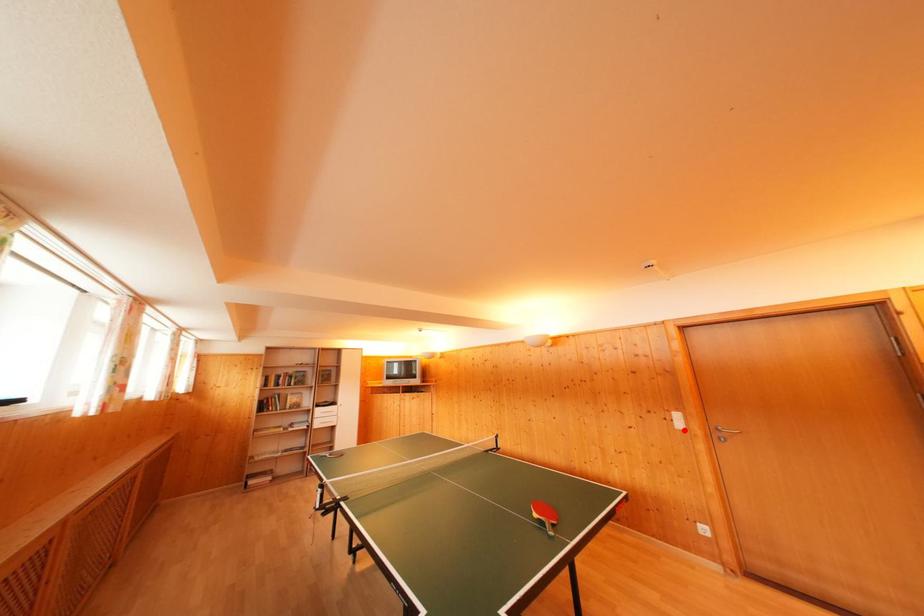
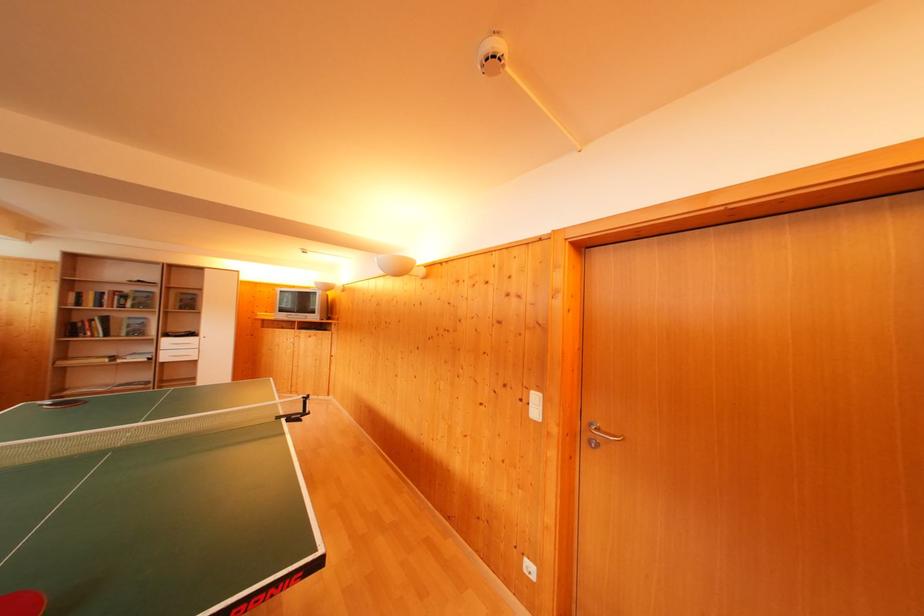
Where in the second image is the point corresponding to the highlighted location from the first image?

(541, 418)